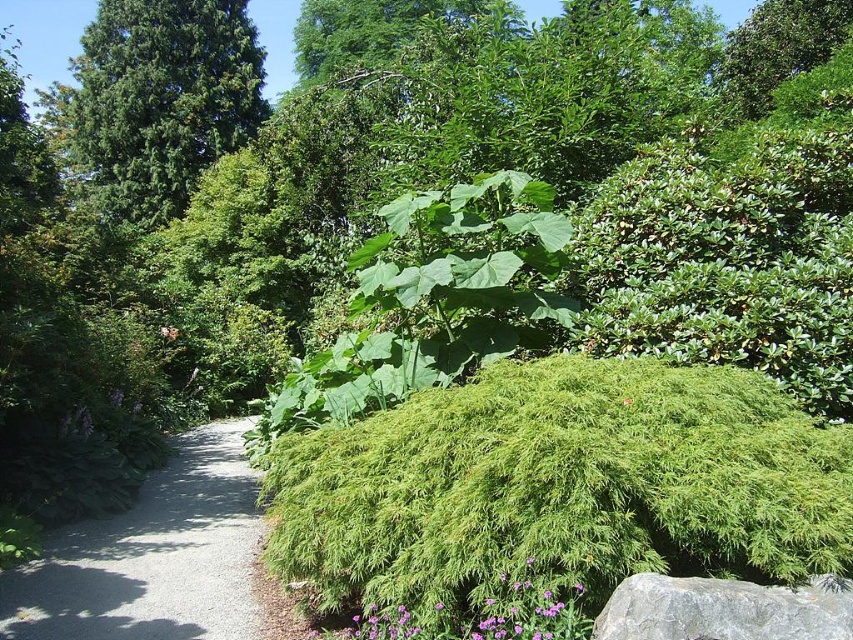
You are a gardener planning to water the green leafy bush at center and the gray gravel path at lower left. Which one should you water first if you want to start from the nearest object to the viewer?

The green leafy bush at center is closer to the viewer than the gray gravel path at lower left, so you should water the green leafy bush at center first.

You are standing at the center of the gravel pathway in the garden. You see a green leafy bush at center and a prominent bush with dense, feathery foliage on the right side. Which direction should you walk to reach the point marked at coordinates [560,486]?

The point marked at coordinates [560,486] corresponds to the green leafy bush at center, so you should walk towards the center of the gravel pathway to reach it.

You are standing at the camera position looking at the garden. There are two points marked in the image, point 1 at coordinates point (486, 472) and point 2 at coordinates point (91, 136). Which point is nearer to you?

Point (486, 472) is closer to the camera than point (91, 136), so point 1 is nearer to you.